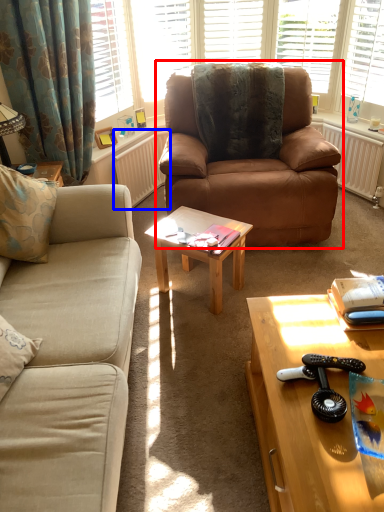
Question: Which object appears farthest to the camera in this image, studio couch (highlighted by a red box) or radiator (highlighted by a blue box)?

Choices:
 (A) studio couch
 (B) radiator

Answer: (B)